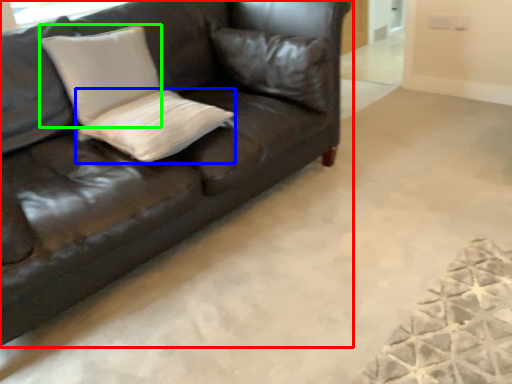
Question: Which object is the closest to the studio couch (highlighted by a red box)? Choose among these: pillow (highlighted by a blue box) or pillow (highlighted by a green box).

Choices:
 (A) pillow
 (B) pillow

Answer: (A)